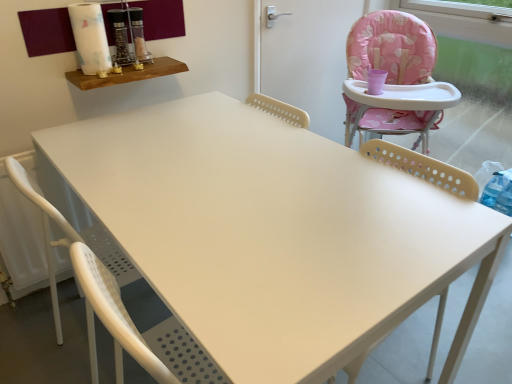
Describe the element at coordinates (127, 74) in the screenshot. I see `wooden shelf at upper left` at that location.

Consider the image. What is the approximate height of pink fabric screen door at upper right?

pink fabric screen door at upper right is 25.66 inches in height.

This screenshot has width=512, height=384. In order to click on white perforated chair at lower left, which is counted as the 1th chair, starting from the left in this screenshot , I will do [91, 290].

From a real-world perspective, who is located higher, wooden shelf at upper left or pink fabric screen door at upper right?

In real-world perspective, wooden shelf at upper left is above.

Are wooden shelf at upper left and pink fabric screen door at upper right far apart?

No.

Which object is positioned more to the right, wooden shelf at upper left or pink fabric screen door at upper right?

pink fabric screen door at upper right.

Which of these two, wooden shelf at upper left or pink fabric screen door at upper right, is smaller?

Smaller between the two is wooden shelf at upper left.

Which of these two, white perforated chair at lower left, which is counted as the 1th chair, starting from the left, or pink fabric screen door at upper right, stands taller?

Standing taller between the two is white perforated chair at lower left, which is counted as the 1th chair, starting from the left.

Which object is closer to the camera taking this photo, white perforated chair at lower left, which is counted as the 1th chair, starting from the left, or pink fabric screen door at upper right?

white perforated chair at lower left, which is counted as the 1th chair, starting from the left, is more forward.

Which is closer, (56,295) or (310,36)?

Positioned in front is point (56,295).

Is wooden shelf at upper left facing away from beige perforated chair at right, which ranks as the first chair in right-to-left order?

No, wooden shelf at upper left is not facing away from beige perforated chair at right, which ranks as the first chair in right-to-left order.

Considering the relative sizes of wooden shelf at upper left and beige perforated chair at right, arranged as the 2th chair when viewed from the left, in the image provided, is wooden shelf at upper left shorter than beige perforated chair at right, arranged as the 2th chair when viewed from the left,?

Indeed, wooden shelf at upper left has a lesser height compared to beige perforated chair at right, arranged as the 2th chair when viewed from the left.

Could beige perforated chair at right, which ranks as the first chair in right-to-left order, be considered to be inside wooden shelf at upper left?

Definitely not — beige perforated chair at right, which ranks as the first chair in right-to-left order, is not inside wooden shelf at upper left.

From the image's perspective, which is below, wooden shelf at upper left or beige perforated chair at right, which ranks as the first chair in right-to-left order?

beige perforated chair at right, which ranks as the first chair in right-to-left order, from the image's perspective.

Does pink fabric screen door at upper right have a lesser width compared to beige perforated chair at right, which ranks as the first chair in right-to-left order?

Indeed, pink fabric screen door at upper right has a lesser width compared to beige perforated chair at right, which ranks as the first chair in right-to-left order.

Is the depth of pink fabric screen door at upper right greater than that of beige perforated chair at right, which ranks as the first chair in right-to-left order?

Yes, it is.

From the picture: From a real-world perspective, is pink fabric screen door at upper right physically located above or below beige perforated chair at right, arranged as the 2th chair when viewed from the left?

pink fabric screen door at upper right is situated higher than beige perforated chair at right, arranged as the 2th chair when viewed from the left, in the real world.

Between pink fabric screen door at upper right and beige perforated chair at right, arranged as the 2th chair when viewed from the left, which one appears on the left side from the viewer's perspective?

beige perforated chair at right, arranged as the 2th chair when viewed from the left.

Do you think white perforated chair at lower left, which is counted as the 1th chair, starting from the left, is within wooden shelf at upper left, or outside of it?

white perforated chair at lower left, which is counted as the 1th chair, starting from the left, is not inside wooden shelf at upper left, it's outside.

Who is smaller, white perforated chair at lower left, which is counted as the 1th chair, starting from the left, or wooden shelf at upper left?

Smaller between the two is wooden shelf at upper left.

Can you confirm if white perforated chair at lower left, the 2th chair in the right-to-left sequence, is thinner than wooden shelf at upper left?

In fact, white perforated chair at lower left, the 2th chair in the right-to-left sequence, might be wider than wooden shelf at upper left.

Considering the sizes of white perforated chair at lower left, the 2th chair in the right-to-left sequence, and wooden shelf at upper left in the image, is white perforated chair at lower left, the 2th chair in the right-to-left sequence, taller or shorter than wooden shelf at upper left?

Considering their sizes, white perforated chair at lower left, the 2th chair in the right-to-left sequence, has more height than wooden shelf at upper left.

Which is behind, point (313, 28) or point (118, 362)?

Point (313, 28)

Would you consider pink fabric screen door at upper right to be distant from white perforated chair at lower left, which is counted as the 1th chair, starting from the left?

That's right, there is a large distance between pink fabric screen door at upper right and white perforated chair at lower left, which is counted as the 1th chair, starting from the left.

From the image's perspective, which one is positioned higher, pink fabric screen door at upper right or white perforated chair at lower left, the 2th chair in the right-to-left sequence?

pink fabric screen door at upper right is shown above in the image.

From the picture: Considering the sizes of pink fabric screen door at upper right and wooden shelf at upper left in the image, is pink fabric screen door at upper right wider or thinner than wooden shelf at upper left?

Considering their sizes, pink fabric screen door at upper right looks slimmer than wooden shelf at upper left.

Is point (294, 12) closer or farther from the camera than point (170, 65)?

Point (294, 12).

From the image's perspective, who appears lower, pink fabric screen door at upper right or wooden shelf at upper left?

wooden shelf at upper left, from the image's perspective.

From a real-world perspective, is pink fabric screen door at upper right on wooden shelf at upper left?

Incorrect, from a real-world perspective, pink fabric screen door at upper right is lower than wooden shelf at upper left.

Identify the location of screen door behind the wooden shelf at upper left. (307, 58).

The height and width of the screenshot is (384, 512). In order to click on the 2nd chair located beneath the pink fabric screen door at upper right (from a real-world perspective) in this screenshot , I will do `click(91, 290)`.

Looking at the image, which one is located further to white perforated chair at lower left, which is counted as the 1th chair, starting from the left, wooden shelf at upper left or pink fabric screen door at upper right?

Among the two, pink fabric screen door at upper right is located further to white perforated chair at lower left, which is counted as the 1th chair, starting from the left.

From the image, which object appears to be farther from wooden shelf at upper left, pink fabric screen door at upper right or beige perforated chair at right, which ranks as the first chair in right-to-left order?

Among the two, beige perforated chair at right, which ranks as the first chair in right-to-left order, is located further to wooden shelf at upper left.

Consider the image. When comparing their distances from beige perforated chair at right, which ranks as the first chair in right-to-left order, does white perforated chair at lower left, which is counted as the 1th chair, starting from the left, or pink fabric screen door at upper right seem closer?

white perforated chair at lower left, which is counted as the 1th chair, starting from the left, is positioned closer to the anchor beige perforated chair at right, which ranks as the first chair in right-to-left order.

Looking at the image, which one is located closer to beige perforated chair at right, arranged as the 2th chair when viewed from the left, white perforated chair at lower left, the 2th chair in the right-to-left sequence, or wooden shelf at upper left?

wooden shelf at upper left is positioned closer to the anchor beige perforated chair at right, arranged as the 2th chair when viewed from the left.

When comparing their distances from white perforated chair at lower left, the 2th chair in the right-to-left sequence, does pink fabric screen door at upper right or beige perforated chair at right, arranged as the 2th chair when viewed from the left, seem closer?

Among the two, beige perforated chair at right, arranged as the 2th chair when viewed from the left, is located nearer to white perforated chair at lower left, the 2th chair in the right-to-left sequence.

Looking at the image, which one is located closer to white perforated chair at lower left, which is counted as the 1th chair, starting from the left, beige perforated chair at right, which ranks as the first chair in right-to-left order, or wooden shelf at upper left?

Based on the image, wooden shelf at upper left appears to be nearer to white perforated chair at lower left, which is counted as the 1th chair, starting from the left.

From the picture: Based on their spatial positions, is wooden shelf at upper left or beige perforated chair at right, which ranks as the first chair in right-to-left order, further from pink fabric screen door at upper right?

beige perforated chair at right, which ranks as the first chair in right-to-left order, is positioned further to the anchor pink fabric screen door at upper right.

Looking at the image, which one is located further to pink fabric screen door at upper right, white perforated chair at lower left, which is counted as the 1th chair, starting from the left, or beige perforated chair at right, which ranks as the first chair in right-to-left order?

The object further to pink fabric screen door at upper right is white perforated chair at lower left, which is counted as the 1th chair, starting from the left.

The width and height of the screenshot is (512, 384). Identify the location of table between beige perforated chair at right, which ranks as the first chair in right-to-left order, and pink fabric screen door at upper right in the front-back direction. (127, 74).

Where is `table positioned between white perforated chair at lower left, the 2th chair in the right-to-left sequence, and pink fabric screen door at upper right from near to far`? This screenshot has height=384, width=512. table positioned between white perforated chair at lower left, the 2th chair in the right-to-left sequence, and pink fabric screen door at upper right from near to far is located at coordinates (127, 74).

The width and height of the screenshot is (512, 384). In order to click on chair between beige perforated chair at right, which ranks as the first chair in right-to-left order, and pink fabric screen door at upper right, along the z-axis in this screenshot , I will do `click(91, 290)`.

Where is `chair between wooden shelf at upper left and beige perforated chair at right, arranged as the 2th chair when viewed from the left, from left to right`? The height and width of the screenshot is (384, 512). chair between wooden shelf at upper left and beige perforated chair at right, arranged as the 2th chair when viewed from the left, from left to right is located at coordinates (91, 290).